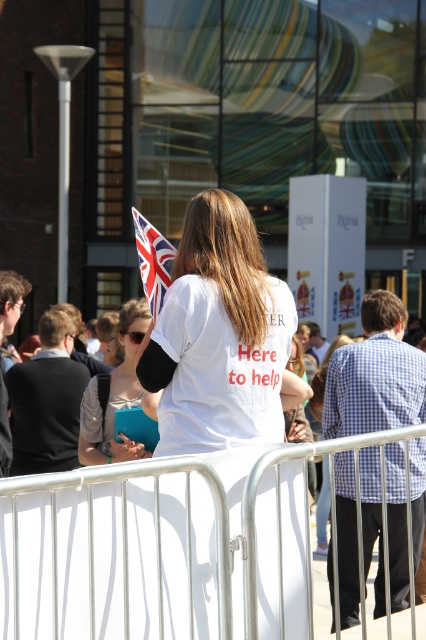
Does white fabric shirt at center have a smaller size compared to polyester flag at upper center?

Incorrect, white fabric shirt at center is not smaller in size than polyester flag at upper center.

Can you confirm if white fabric shirt at center is positioned below polyester flag at upper center?

Yes.

Looking at this image, who is more distant from viewer, (134,378) or (141,246)?

Point (134,378)

This screenshot has height=640, width=426. What are the coordinates of `white fabric shirt at center` in the screenshot? It's located at (115, 394).

Is white matte shirt at center in front of white fabric shirt at center?

Yes.

From the picture: Who is higher up, white matte shirt at center or white fabric shirt at center?

white matte shirt at center is above.

The width and height of the screenshot is (426, 640). Identify the location of white matte shirt at center. (218, 336).

Between white matte shirt at center and polyester flag at upper center, which one is positioned higher?

Positioned higher is polyester flag at upper center.

Between white matte shirt at center and polyester flag at upper center, which one has less height?

Standing shorter between the two is polyester flag at upper center.

Who is more forward, (230,230) or (169,273)?

Point (230,230) is more forward.

Find the location of a particular element. The image size is (426, 640). white matte shirt at center is located at coordinates (218, 336).